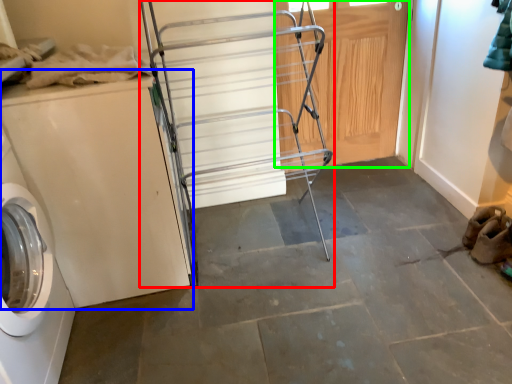
Question: Estimate the real-world distances between objects in this image. Which object is farther from cart (highlighted by a red box), washing machine (highlighted by a blue box) or door (highlighted by a green box)?

Choices:
 (A) washing machine
 (B) door

Answer: (A)